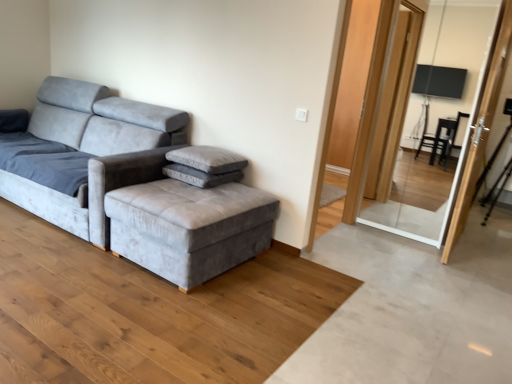
Question: Looking at their shapes, would you say gray velvety pillow at center is wider or thinner than velvet grey ottoman at center?

Choices:
 (A) wide
 (B) thin

Answer: (B)

Question: Based on their positions, is gray velvety pillow at center located to the left or right of velvet grey ottoman at center?

Choices:
 (A) left
 (B) right

Answer: (B)

Question: Estimate the real-world distances between objects in this image. Which object is farther from the velvet gray couch at left?

Choices:
 (A) gray fabric footrest at center
 (B) transparent glass screen door at upper right, the first screen door when ordered from left to right
 (C) velvet grey ottoman at center
 (D) matte black screen door at upper right, the 1th screen door viewed from the right
 (E) gray velvety pillow at center

Answer: (B)

Question: Which object is positioned farthest from the velvet gray couch at left?

Choices:
 (A) velvet grey ottoman at center
 (B) gray fabric footrest at center
 (C) transparent glass screen door at upper right, the second screen door from the right
 (D) gray velvety pillow at center
 (E) matte black screen door at upper right, the 1th screen door viewed from the right

Answer: (C)